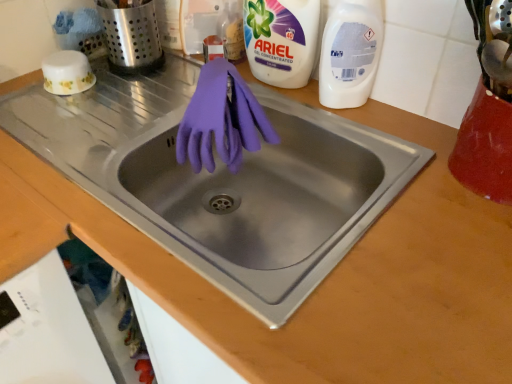
Where is `vacant position to the left of white plastic bottle at upper right, which is the second cleaning product from left to right`? Image resolution: width=512 pixels, height=384 pixels. vacant position to the left of white plastic bottle at upper right, which is the second cleaning product from left to right is located at coordinates (287, 106).